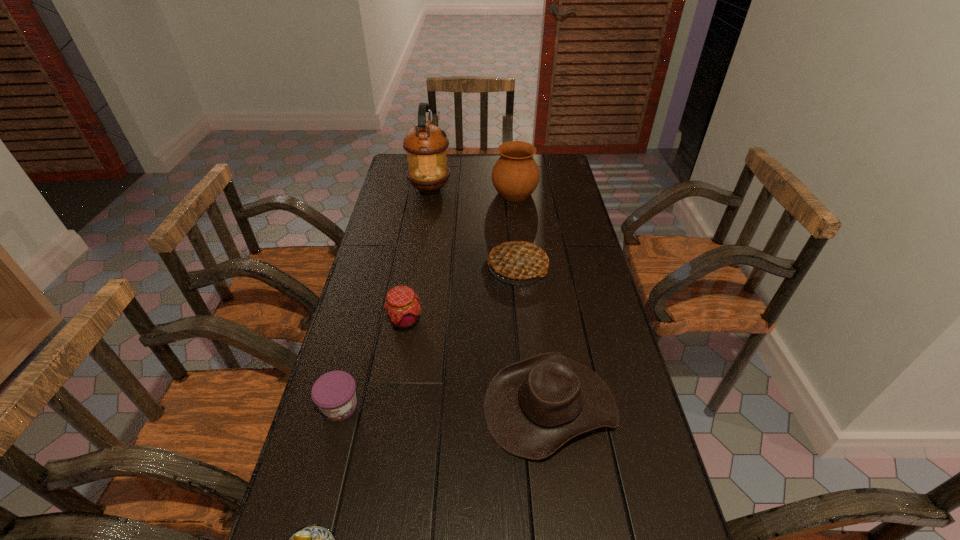
Locate an element on the screen. free spot between the third tallest object and the cowboy hat is located at coordinates (534, 336).

In order to click on free space between the cowboy hat and the fifth nearest object in this screenshot , I will do `click(534, 336)`.

Select which object is the closest to the fifth nearest object. Please provide its 2D coordinates. Your answer should be formatted as a tuple, i.e. [(x, y)], where the tuple contains the x and y coordinates of a point satisfying the conditions above.

[(402, 307)]

I want to click on object that is the fifth nearest to the left jam, so click(x=425, y=144).

Find the location of a particular element. free space that satisfies the following two spatial constraints: 1. on the front side of the cowboy hat; 2. on the right side of the taller jam is located at coordinates (391, 406).

At what (x,y) coordinates should I click in order to perform the action: click on blank area in the image that satisfies the following two spatial constraints: 1. on the front side of the fifth shortest object; 2. on the left side of the cowboy hat. Please return your answer as a coordinate pair (x, y). The height and width of the screenshot is (540, 960). Looking at the image, I should click on (531, 406).